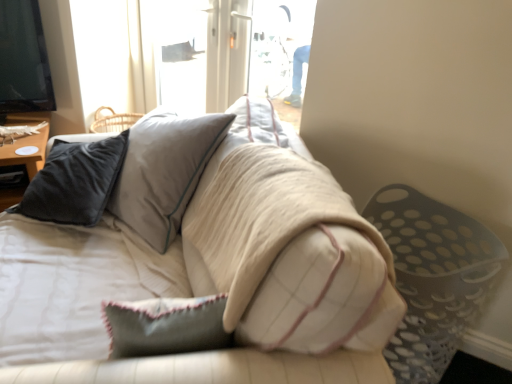
Question: Is soft beige fabric couch at center taller or shorter than matte black pillow at left?

Choices:
 (A) short
 (B) tall

Answer: (B)

Question: Is soft beige fabric couch at center inside the boundaries of matte black pillow at left, or outside?

Choices:
 (A) outside
 (B) inside

Answer: (A)

Question: Looking at their shapes, would you say soft beige fabric couch at center is wider or thinner than matte black pillow at left?

Choices:
 (A) wide
 (B) thin

Answer: (A)

Question: Considering the relative positions of matte black pillow at left and soft beige fabric couch at center in the image provided, is matte black pillow at left to the left or to the right of soft beige fabric couch at center?

Choices:
 (A) left
 (B) right

Answer: (A)

Question: Do you think matte black pillow at left is within soft beige fabric couch at center, or outside of it?

Choices:
 (A) outside
 (B) inside

Answer: (A)

Question: From the image's perspective, is matte black pillow at left located above or below soft beige fabric couch at center?

Choices:
 (A) above
 (B) below

Answer: (A)

Question: Is matte black pillow at left in front of or behind soft beige fabric couch at center in the image?

Choices:
 (A) behind
 (B) front

Answer: (A)